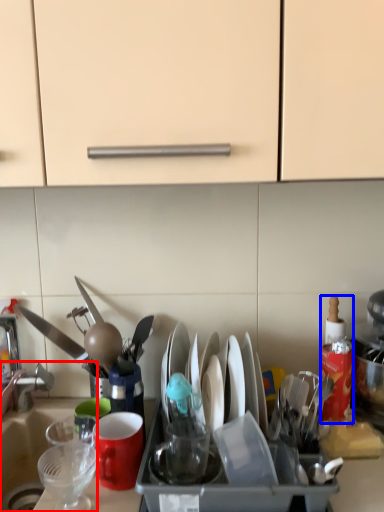
Question: Which of the following is the farthest to the observer, sink (highlighted by a red box) or bottle (highlighted by a blue box)?

Choices:
 (A) sink
 (B) bottle

Answer: (B)